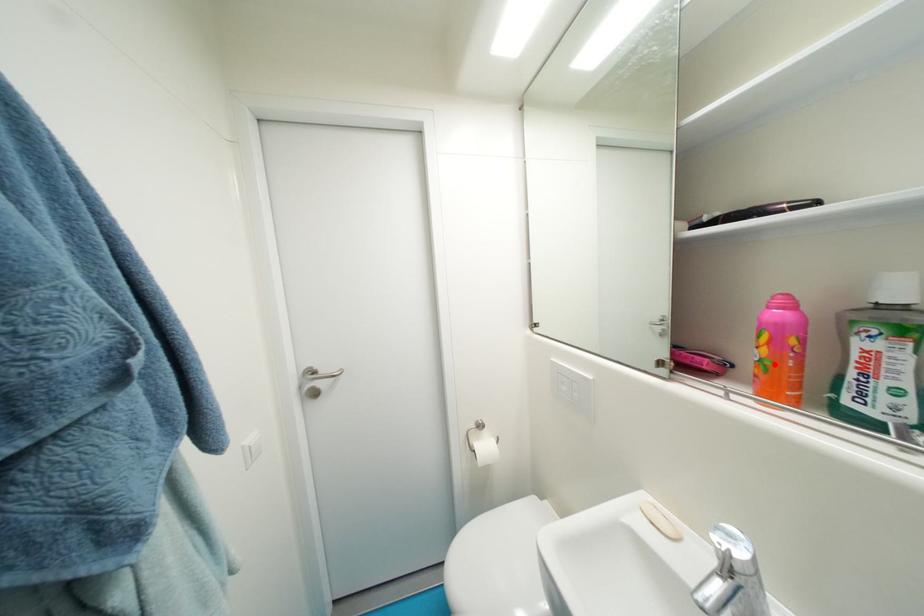
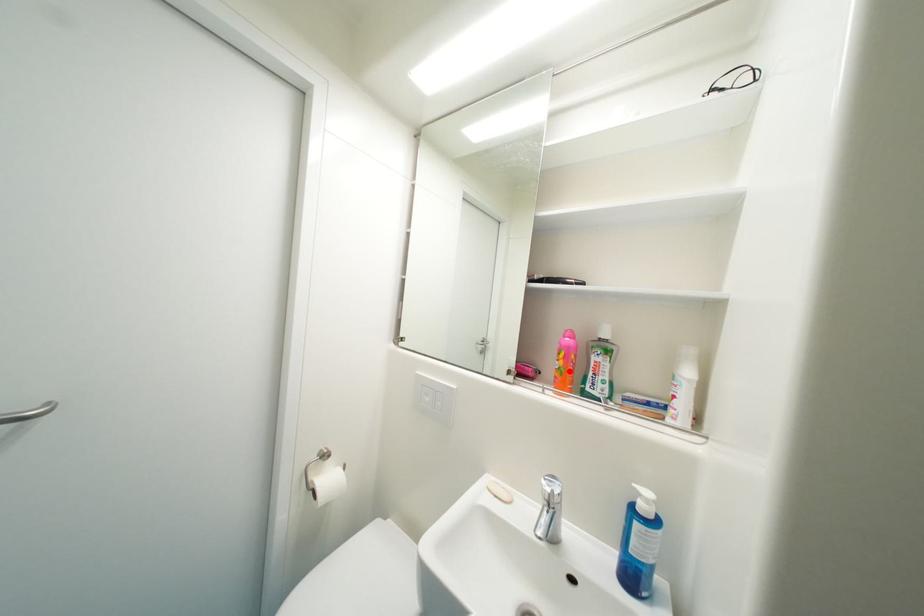
I am providing you with two images of the same scene from different viewpoints. A red point is marked on the first image and another point is marked on the second image. Are the points marked in image1 and image2 representing the same 3D position?

Yes